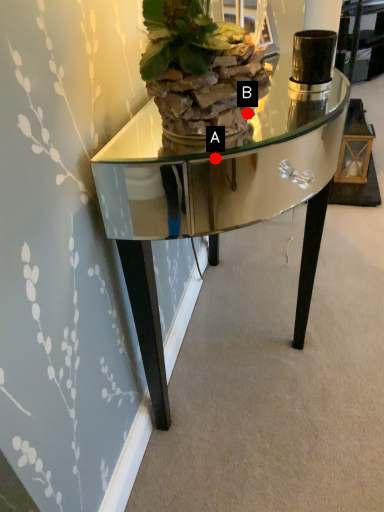
Question: Two points are circled on the image, labeled by A and B beside each circle. Which of the following is the farthest from the observer?

Choices:
 (A) A is further
 (B) B is further

Answer: (A)